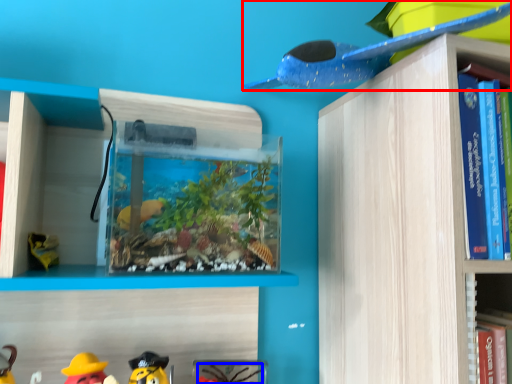
Question: Which of the following is the farthest to the observer, toy (highlighted by a red box) or toy (highlighted by a blue box)?

Choices:
 (A) toy
 (B) toy

Answer: (B)